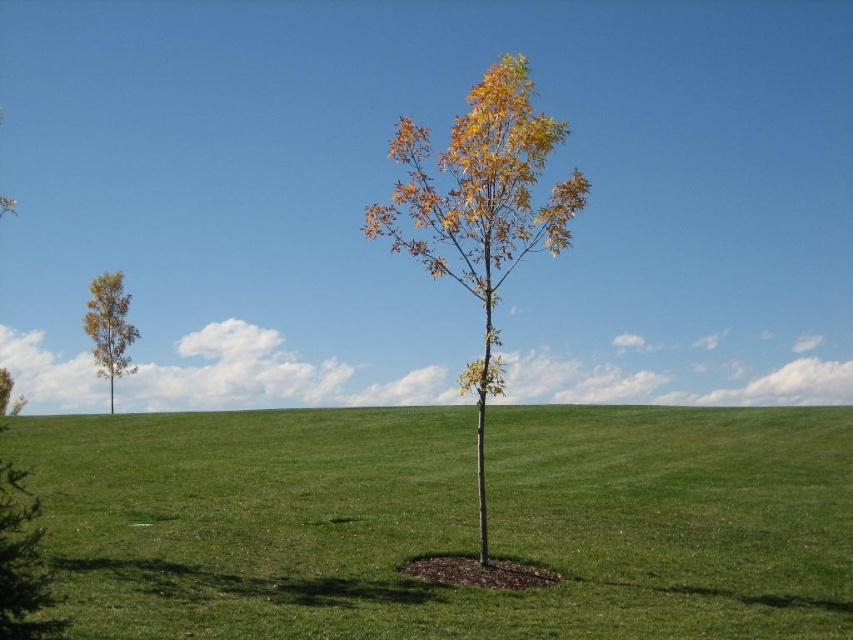
Question: Can you confirm if green grassy at center is positioned above yellow-green foliage at center?

Choices:
 (A) no
 (B) yes

Answer: (A)

Question: Does yellow-green foliage at center appear on the left side of smooth brown tree at left?

Choices:
 (A) yes
 (B) no

Answer: (B)

Question: Estimate the real-world distances between objects in this image. Which object is closer to the green grassy at center?

Choices:
 (A) yellow-green foliage at center
 (B) smooth brown tree at left

Answer: (A)

Question: Does green grassy at center come behind yellow-green foliage at center?

Choices:
 (A) no
 (B) yes

Answer: (A)

Question: Estimate the real-world distances between objects in this image. Which object is closer to the yellow-green foliage at center?

Choices:
 (A) smooth brown tree at left
 (B) green grassy at center

Answer: (B)

Question: Which of the following is the closest to the observer?

Choices:
 (A) yellow-green foliage at center
 (B) smooth brown tree at left
 (C) green grassy at center

Answer: (C)